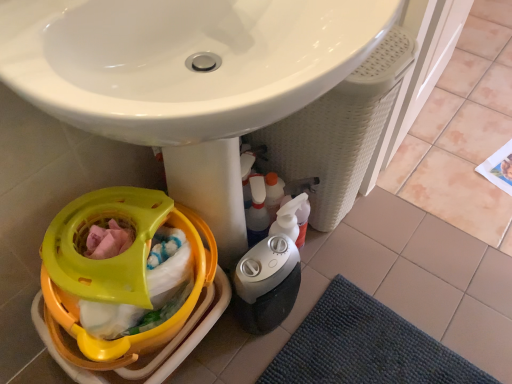
Question: From the image's perspective, is dark blue textured bath mat at lower right located above gray plastic humidifier at lower center?

Choices:
 (A) no
 (B) yes

Answer: (A)

Question: Is dark blue textured bath mat at lower right aimed at gray plastic humidifier at lower center?

Choices:
 (A) yes
 (B) no

Answer: (B)

Question: Is dark blue textured bath mat at lower right next to gray plastic humidifier at lower center?

Choices:
 (A) no
 (B) yes

Answer: (A)

Question: Is dark blue textured bath mat at lower right taller than gray plastic humidifier at lower center?

Choices:
 (A) no
 (B) yes

Answer: (A)

Question: From a real-world perspective, is dark blue textured bath mat at lower right on top of gray plastic humidifier at lower center?

Choices:
 (A) yes
 (B) no

Answer: (B)

Question: From the image's perspective, is gray plastic humidifier at lower center above or below white glossy sink at center?

Choices:
 (A) above
 (B) below

Answer: (B)

Question: From a real-world perspective, relative to white glossy sink at center, is gray plastic humidifier at lower center vertically above or below?

Choices:
 (A) below
 (B) above

Answer: (A)

Question: Relative to white glossy sink at center, is gray plastic humidifier at lower center in front or behind?

Choices:
 (A) front
 (B) behind

Answer: (B)

Question: Looking at the image, does gray plastic humidifier at lower center seem bigger or smaller compared to white glossy sink at center?

Choices:
 (A) small
 (B) big

Answer: (A)

Question: Is dark blue textured bath mat at lower right bigger or smaller than yellow plastic baby carriage at lower left?

Choices:
 (A) big
 (B) small

Answer: (B)

Question: In terms of height, does dark blue textured bath mat at lower right look taller or shorter compared to yellow plastic baby carriage at lower left?

Choices:
 (A) short
 (B) tall

Answer: (A)

Question: Is dark blue textured bath mat at lower right situated inside yellow plastic baby carriage at lower left or outside?

Choices:
 (A) outside
 (B) inside

Answer: (A)

Question: Is dark blue textured bath mat at lower right to the left or to the right of yellow plastic baby carriage at lower left in the image?

Choices:
 (A) left
 (B) right

Answer: (B)

Question: Is point (250, 240) closer or farther from the camera than point (54, 274)?

Choices:
 (A) closer
 (B) farther

Answer: (B)

Question: Is translucent plastic spray bottle at lower center inside or outside of yellow plastic baby carriage at lower left?

Choices:
 (A) inside
 (B) outside

Answer: (B)